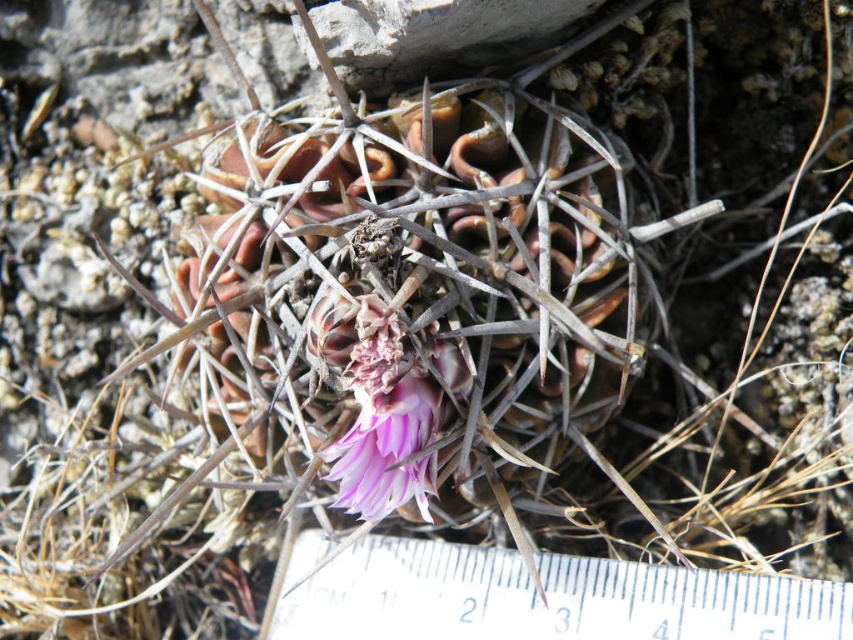
Based on the photo, you are a botanist measuring the pink matte flower at center and the white plastic ruler at center. Which object is bigger in size?

The white plastic ruler at center is larger in size than the pink matte flower at center.